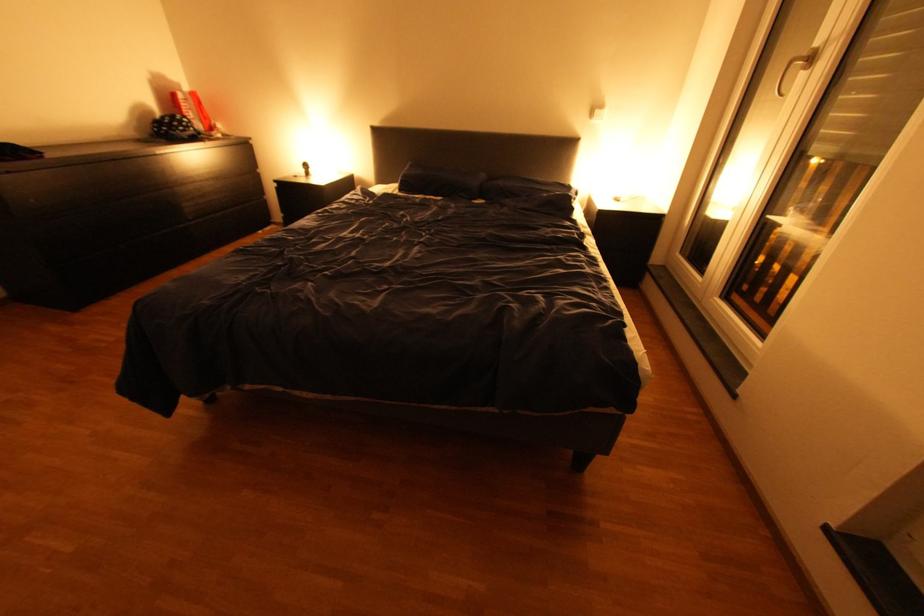
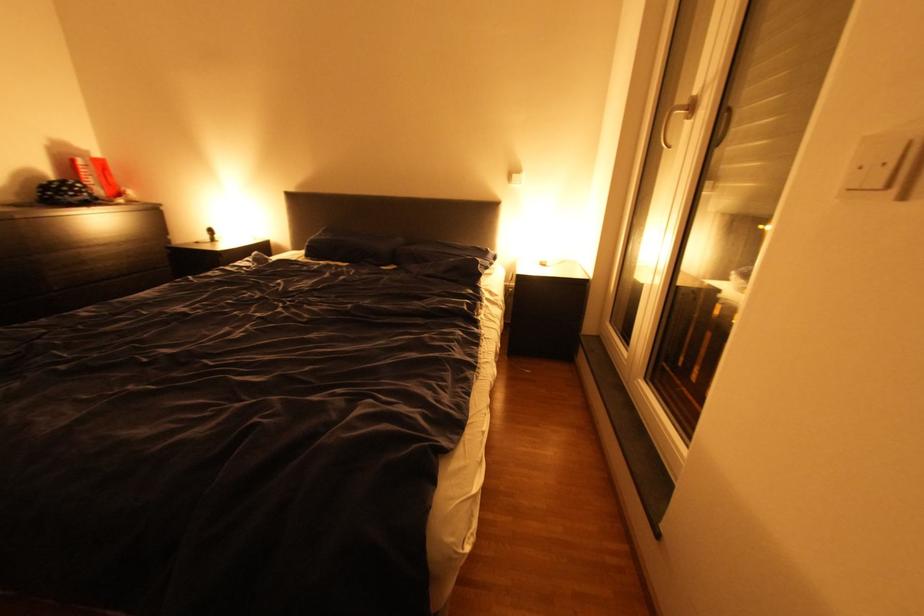
The images are taken continuously from a first-person perspective. In which direction are you moving?

The cameraman walked toward right, forward.